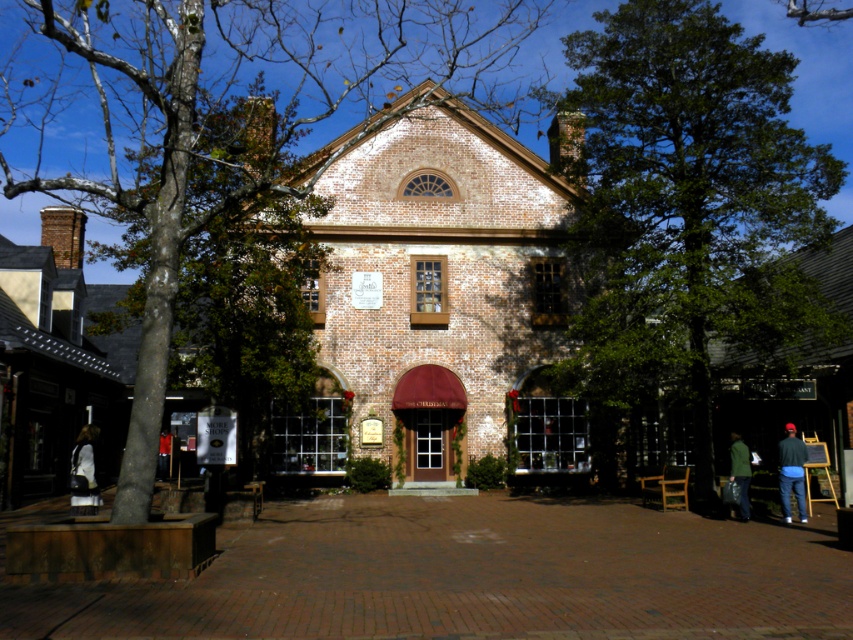
Question: Is green leafy tree at center closer to camera compared to dark blue jeans at lower right?

Choices:
 (A) no
 (B) yes

Answer: (A)

Question: From the image, what is the correct spatial relationship of green leafy tree at center in relation to green matte jacket at lower right?

Choices:
 (A) above
 (B) below

Answer: (A)

Question: Can you confirm if brown textured tree at center is thinner than green leafy tree at center?

Choices:
 (A) yes
 (B) no

Answer: (B)

Question: Based on their relative distances, which object is farther from the white fabric dress at lower left?

Choices:
 (A) brown textured tree at center
 (B) dark blue jeans at lower left

Answer: (A)

Question: Based on their relative distances, which object is nearer to the green leafy tree at center?

Choices:
 (A) dark blue jeans at lower right
 (B) brown textured tree at center

Answer: (A)

Question: Estimate the real-world distances between objects in this image. Which object is farther from the brown textured tree at center?

Choices:
 (A) dark blue jeans at lower left
 (B) white fabric dress at lower left

Answer: (A)